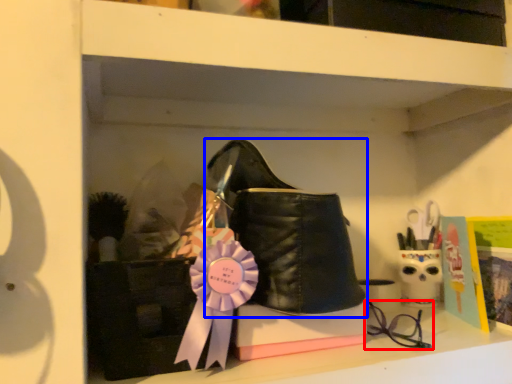
Question: Which object appears farthest to the camera in this image, glasses (highlighted by a red box) or footwear (highlighted by a blue box)?

Choices:
 (A) glasses
 (B) footwear

Answer: (A)